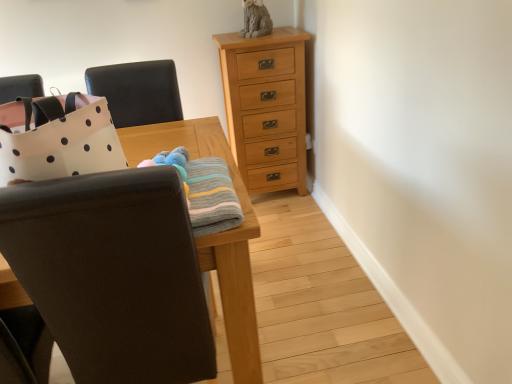
Question: From a real-world perspective, is matte black chair at left, the 2th chair viewed from the top, above or below natural wood chest of drawers at upper center?

Choices:
 (A) above
 (B) below

Answer: (A)

Question: From the image's perspective, relative to natural wood chest of drawers at upper center, is matte black chair at left, which is the first chair from bottom to top, above or below?

Choices:
 (A) below
 (B) above

Answer: (A)

Question: Which object is the farthest from the knitted woolen blanket at center?

Choices:
 (A) matte black chair at left, which is the first chair from bottom to top
 (B) natural wood chest of drawers at upper center
 (C) black leather chair at upper left, the 2th chair ordered from the bottom

Answer: (B)

Question: Which is nearer to the natural wood chest of drawers at upper center?

Choices:
 (A) black leather chair at upper left, the 2th chair ordered from the bottom
 (B) knitted woolen blanket at center
 (C) matte black chair at left, the 2th chair viewed from the top

Answer: (A)